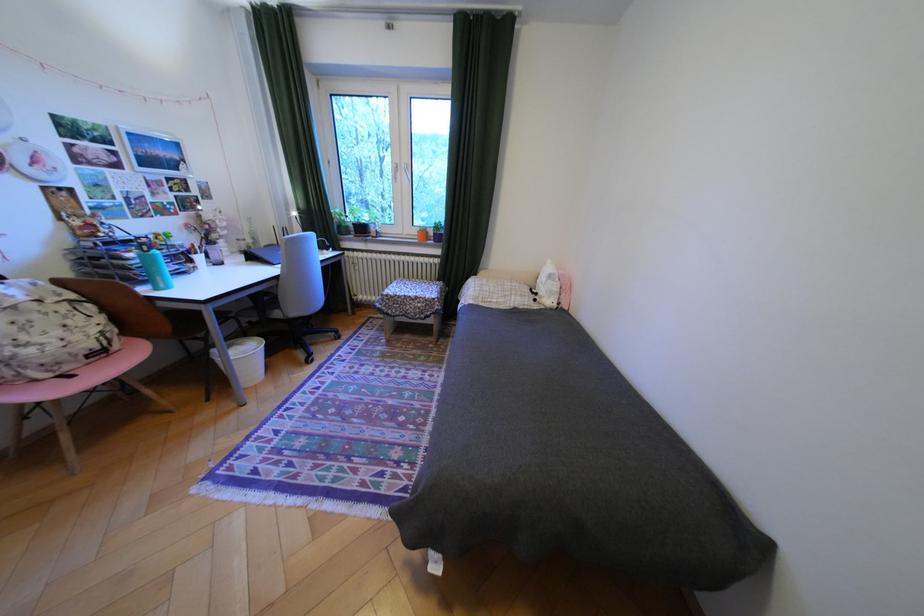
In order to click on white trash can in this screenshot , I will do `click(245, 359)`.